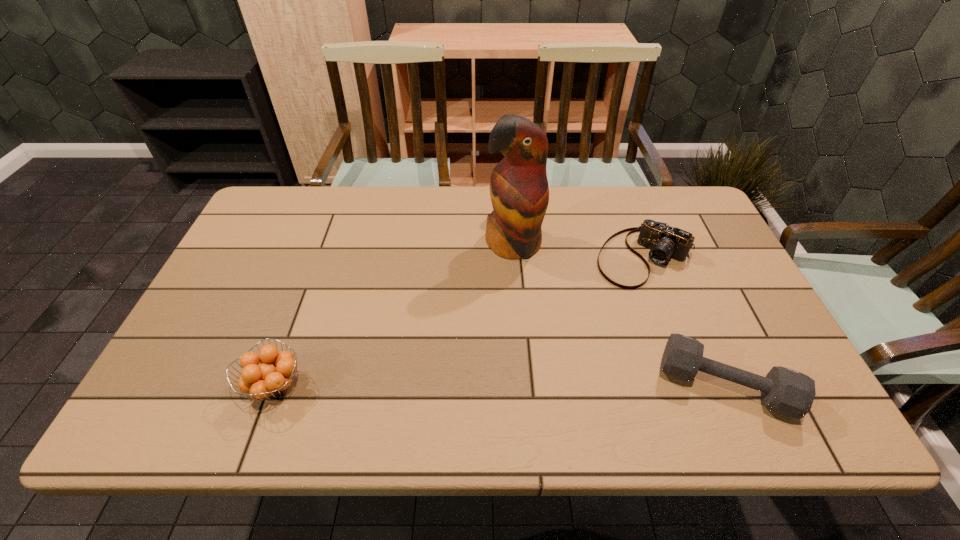
The image size is (960, 540). What are the coordinates of `vacant region between the orange fruit and the dumbbell` in the screenshot? It's located at (499, 385).

I want to click on unoccupied position between the dumbbell and the third object from right to left, so click(x=619, y=315).

The width and height of the screenshot is (960, 540). Identify the location of unoccupied position between the camera and the leftmost object. (459, 321).

This screenshot has height=540, width=960. In order to click on free point between the dumbbell and the third object from right to left in this screenshot , I will do `click(619, 315)`.

Locate an element on the screen. blank region between the dumbbell and the tallest object is located at coordinates (619, 315).

At what (x,y) coordinates should I click in order to perform the action: click on vacant area that lies between the dumbbell and the camera. Please return your answer as a coordinate pair (x, y). This screenshot has height=540, width=960. Looking at the image, I should click on (684, 321).

This screenshot has height=540, width=960. In order to click on unoccupied position between the tallest object and the dumbbell in this screenshot , I will do `click(619, 315)`.

The height and width of the screenshot is (540, 960). Find the location of `the closest object to the tallest object`. the closest object to the tallest object is located at coordinates (665, 242).

Where is `object that stands as the second closest to the camera`? object that stands as the second closest to the camera is located at coordinates click(x=784, y=391).

You are a GUI agent. You are given a task and a screenshot of the screen. Output one action in this format:
    pyautogui.click(x=<x>, y=<y>)
    Task: Click on the vacant space that satisfies the following two spatial constraints: 1. on the back side of the leftmost object; 2. on the left side of the camera
    
    Given the screenshot: What is the action you would take?
    pyautogui.click(x=321, y=258)